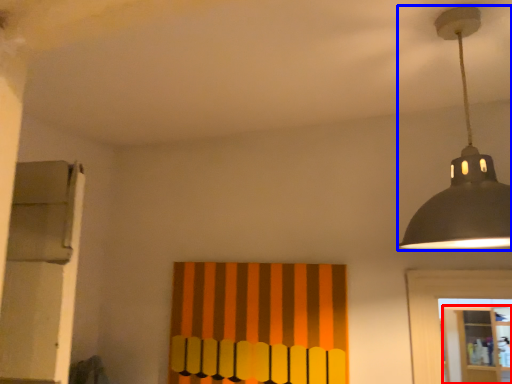
Question: Which of the following is the farthest to the observer, shelf (highlighted by a red box) or lamp (highlighted by a blue box)?

Choices:
 (A) shelf
 (B) lamp

Answer: (A)